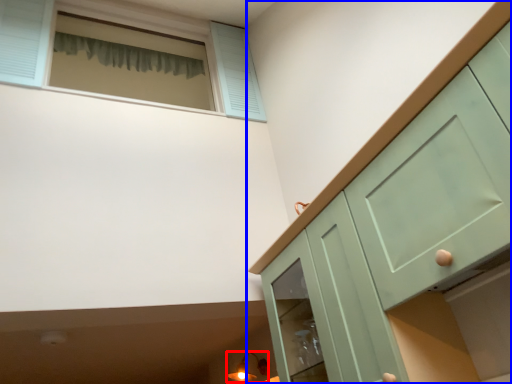
Question: Among these objects, which one is nearest to the camera, light fixture (highlighted by a red box) or cabinetry (highlighted by a blue box)?

Choices:
 (A) light fixture
 (B) cabinetry

Answer: (B)